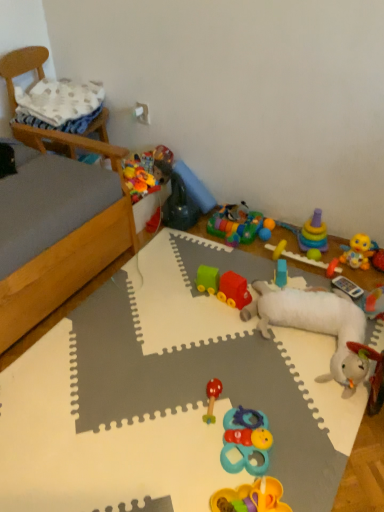
Identify the location of vacant area to the left of multicolored plastic blocks at center, the second toy from the top. (201, 243).